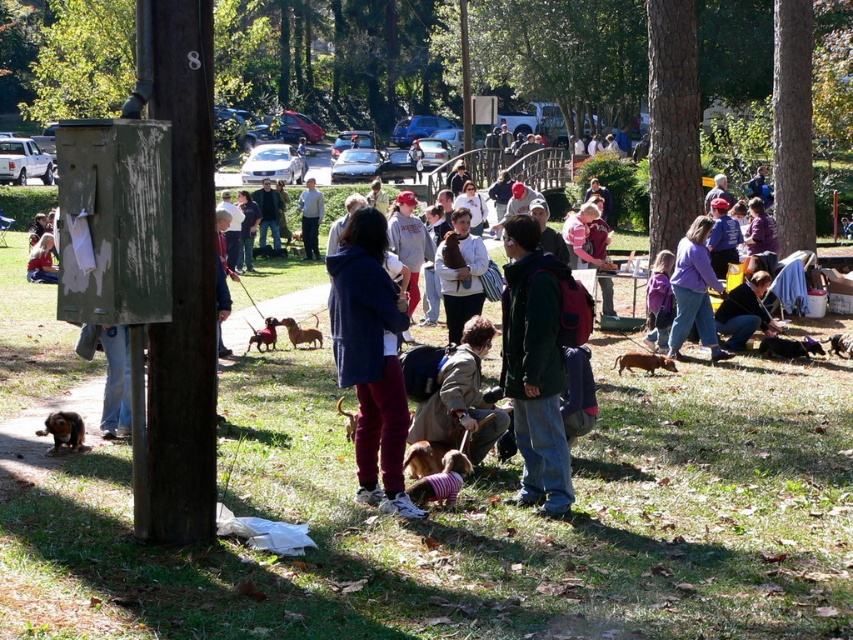
You are a photographer standing at the center of the park and want to take a picture of the dark blue jacket at center. Which direction should you face to ensure the jacket is in the frame?

The dark blue jacket at center is already at the center of the park, so facing the general direction where the jacket is located would naturally keep it in the frame. Since it is at the center point, you don not need to adjust your direction much.